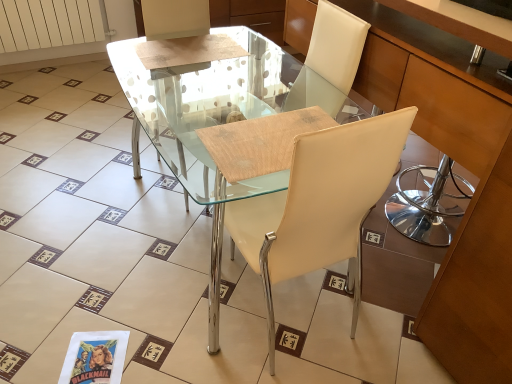
You are a GUI agent. You are given a task and a screenshot of the screen. Output one action in this format:
    pyautogui.click(x=<x>, y=<y>)
    Task: Click on the free region under matte wood cabinet at center (from a real-world perspective)
    Image resolution: width=512 pixels, height=384 pixels.
    Given the screenshot: What is the action you would take?
    pyautogui.click(x=402, y=241)